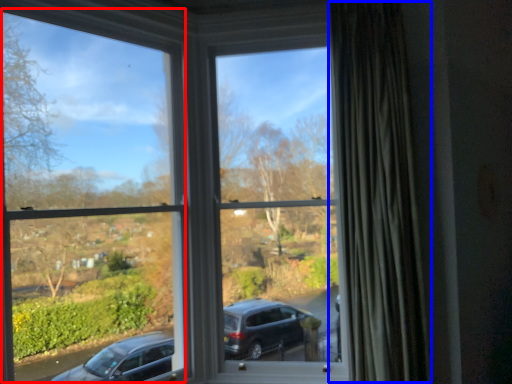
Question: Among these objects, which one is farthest to the camera, window frame (highlighted by a red box) or curtain (highlighted by a blue box)?

Choices:
 (A) window frame
 (B) curtain

Answer: (B)